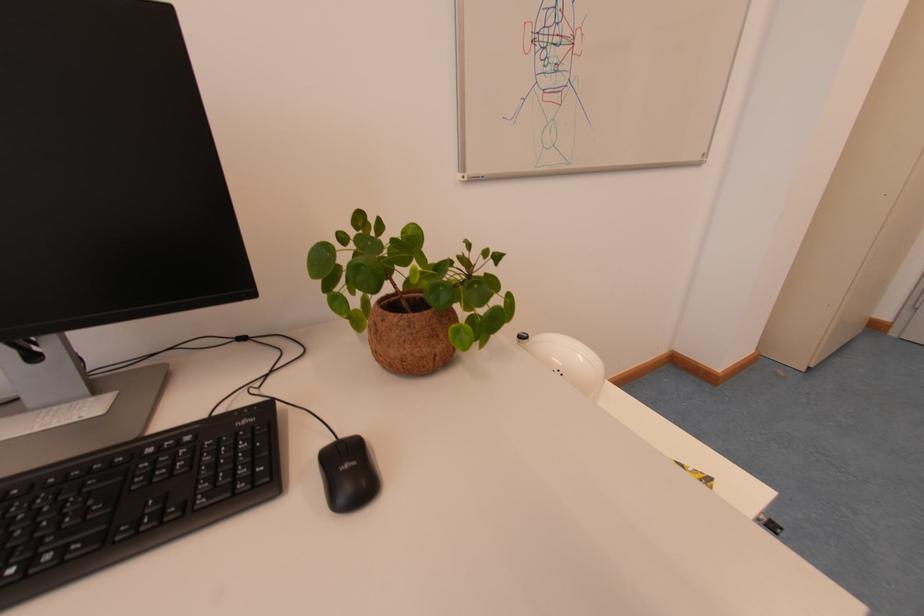
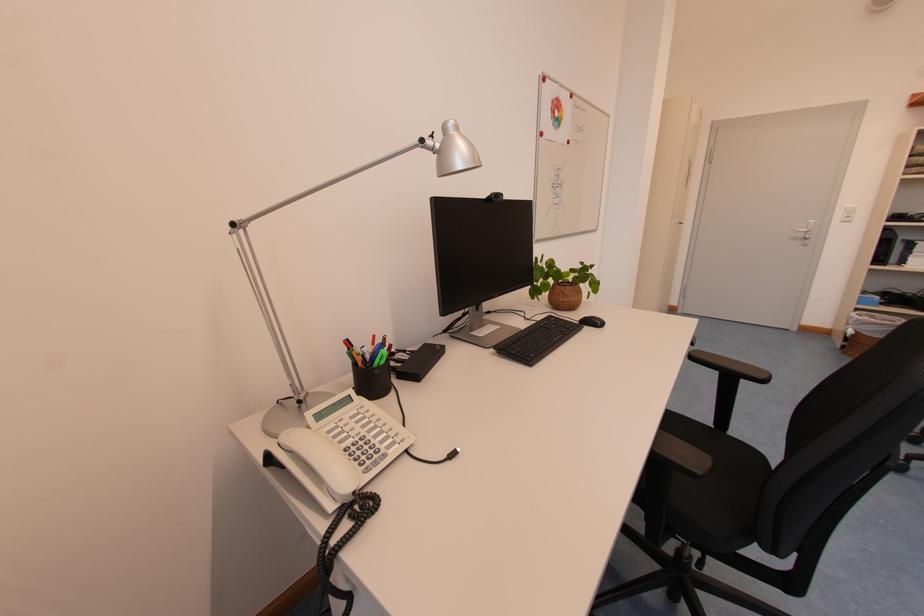
Which direction would the cameraman need to move to produce the second image?

The movement direction of the cameraman is left, backward.